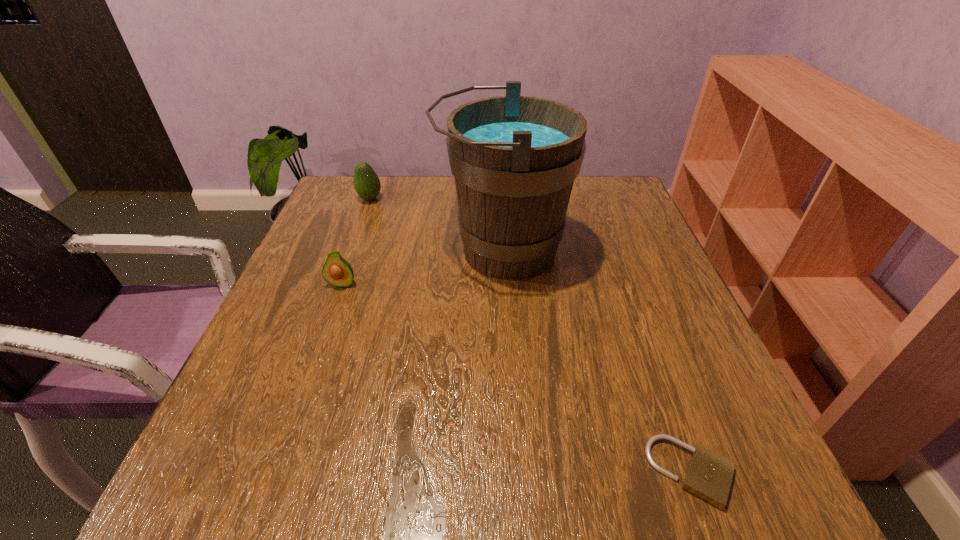
Locate an element on the screen. The image size is (960, 540). vacant position at the left edge of the desktop is located at coordinates (285, 364).

Where is `free space at the right edge`? free space at the right edge is located at coordinates (703, 336).

This screenshot has width=960, height=540. In order to click on vacant space at the near left corner of the desktop in this screenshot , I will do `click(225, 474)`.

What are the coordinates of `vacant region at the far right corner of the desktop` in the screenshot? It's located at (589, 178).

Where is `unoccupied position between the farther avocado and the nearest object`? This screenshot has width=960, height=540. unoccupied position between the farther avocado and the nearest object is located at coordinates (531, 335).

Locate an element on the screen. This screenshot has height=540, width=960. free point between the farthest object and the padlock is located at coordinates (531, 335).

The height and width of the screenshot is (540, 960). In order to click on vacant space in between the nearer avocado and the rightmost object in this screenshot , I will do `click(516, 378)`.

Locate an element on the screen. Image resolution: width=960 pixels, height=540 pixels. vacant space that's between the nearer avocado and the nearest object is located at coordinates (516, 378).

The height and width of the screenshot is (540, 960). I want to click on free space between the shortest object and the tallest object, so click(597, 361).

In order to click on empty space between the third object from left to right and the farthest object in this screenshot , I will do `click(436, 225)`.